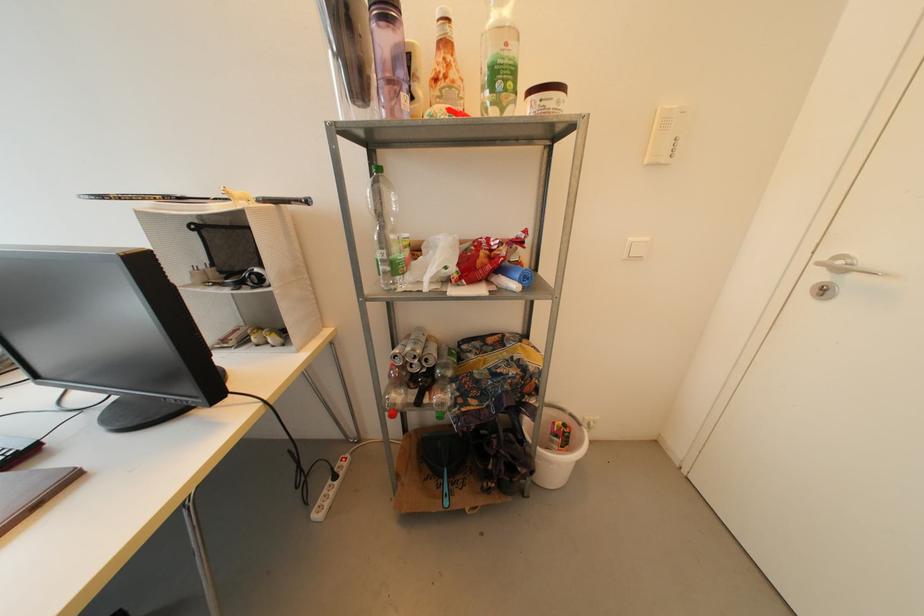
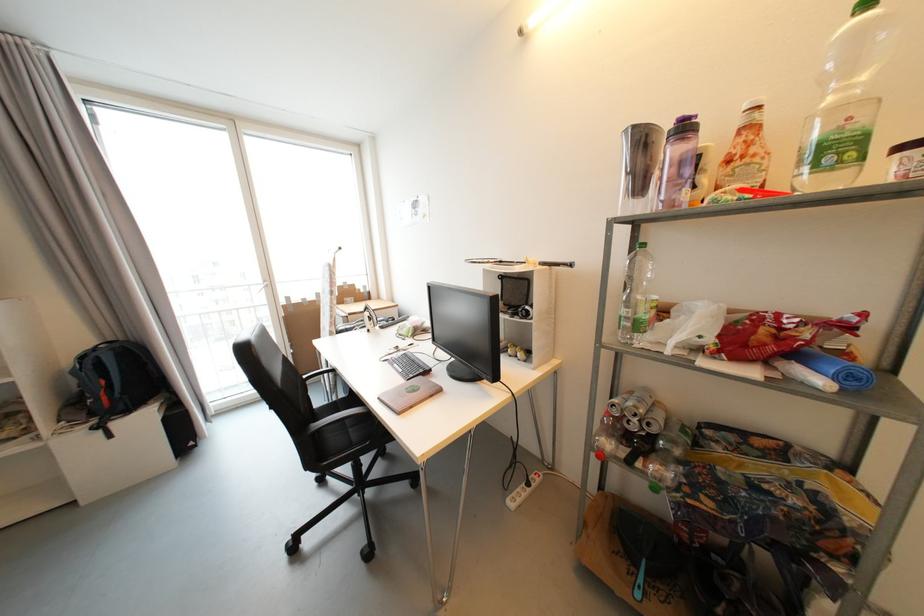
Where in the second image is the point corresponding to point 450,79 from the first image?

(748, 159)